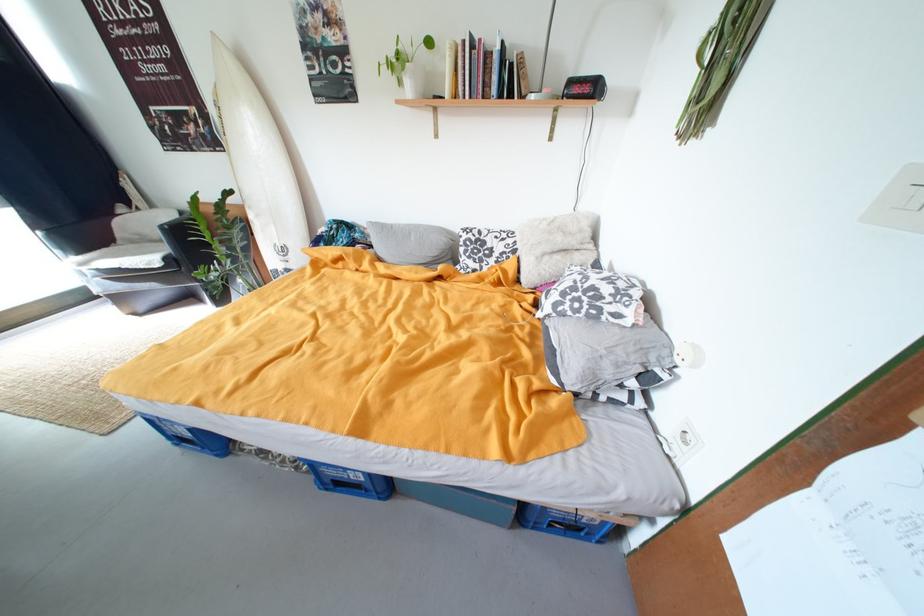
The location [688,355] corresponds to which object?

It refers to a small white lamp.